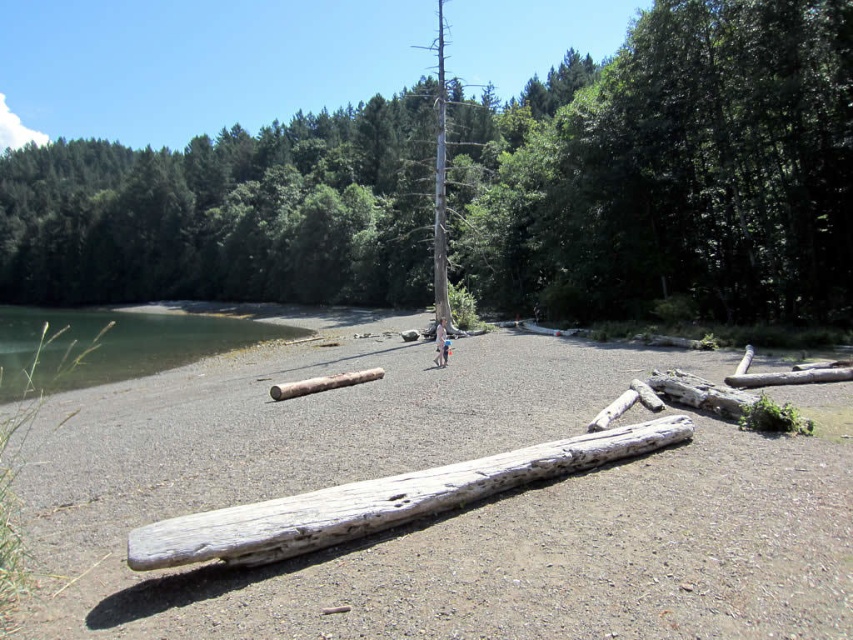
Is gray gravel at center above gray weathered log at center?

Incorrect, gray gravel at center is not positioned above gray weathered log at center.

Can you confirm if gray gravel at center is bigger than gray weathered log at center?

Correct, gray gravel at center is larger in size than gray weathered log at center.

What are the coordinates of `gray gravel at center` in the screenshot? It's located at (444, 518).

Is gray weathered log at center to the right of light blue fabric mountain biker at center from the viewer's perspective?

In fact, gray weathered log at center is to the left of light blue fabric mountain biker at center.

Can you confirm if gray weathered log at center is smaller than light blue fabric mountain biker at center?

Indeed, gray weathered log at center has a smaller size compared to light blue fabric mountain biker at center.

Which is behind, point (325, 380) or point (437, 346)?

The point (437, 346) is more distant.

Where is `gray weathered log at center`? gray weathered log at center is located at coordinates (322, 384).

Can you confirm if gray bark tree at center is taller than gray weathered log at center?

Yes, gray bark tree at center is taller than gray weathered log at center.

The image size is (853, 640). What are the coordinates of `gray bark tree at center` in the screenshot? It's located at (668, 172).